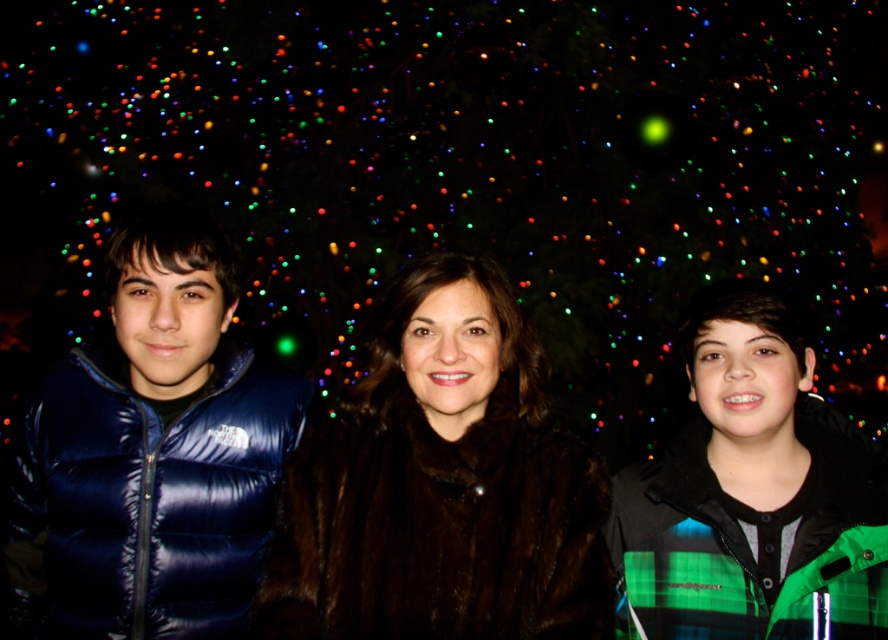
Is brown fur coat at center below green plaid jacket at center?

Yes.

This screenshot has width=888, height=640. What do you see at coordinates (441, 492) in the screenshot? I see `brown fur coat at center` at bounding box center [441, 492].

You are a GUI agent. You are given a task and a screenshot of the screen. Output one action in this format:
    pyautogui.click(x=<x>, y=<y>)
    Task: Click on the brown fur coat at center
    
    Given the screenshot: What is the action you would take?
    pyautogui.click(x=441, y=492)

Is shiny blue vest at left positioned at the back of green plaid jacket at center?

Yes, shiny blue vest at left is behind green plaid jacket at center.

Does point (240, 381) come in front of point (783, 340)?

No, (240, 381) is behind (783, 340).

Find the location of a particular element. shiny blue vest at left is located at coordinates (153, 452).

Can you confirm if brown fur coat at center is thinner than shiny blue vest at left?

No, brown fur coat at center is not thinner than shiny blue vest at left.

Does point (414, 388) come closer to viewer compared to point (252, 465)?

Yes, point (414, 388) is in front of point (252, 465).

Is point (577, 614) closer to camera compared to point (268, 396)?

That is True.

This screenshot has height=640, width=888. Identify the location of brown fur coat at center. (441, 492).